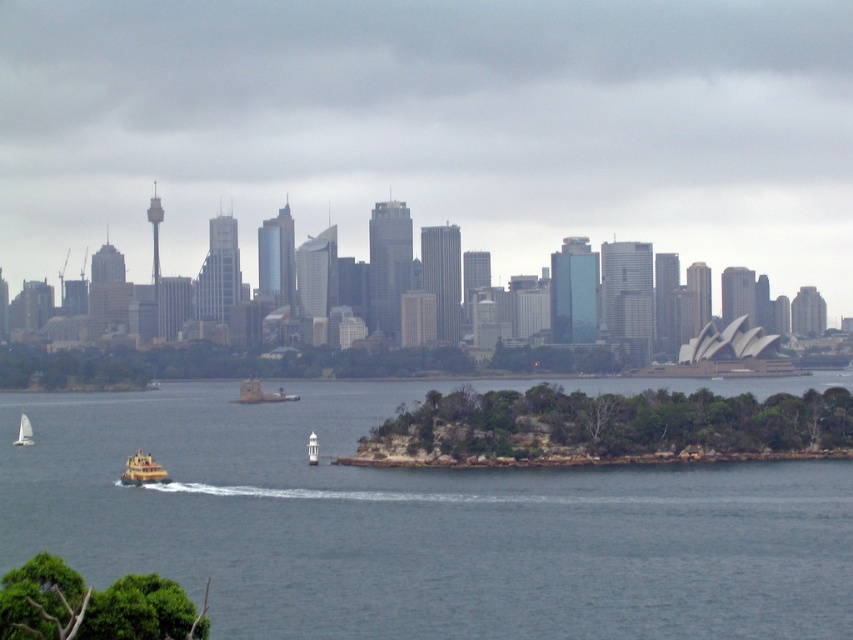
Question: Does transparent glass skyscrapers at center have a larger size compared to yellow matte boat at lower left?

Choices:
 (A) no
 (B) yes

Answer: (B)

Question: Which point is closer to the camera taking this photo?

Choices:
 (A) (x=143, y=476)
 (B) (x=22, y=508)
 (C) (x=22, y=420)

Answer: (A)

Question: From the image, what is the correct spatial relationship of transparent glass skyscrapers at center in relation to yellow matte boat at lower left?

Choices:
 (A) below
 (B) above

Answer: (B)

Question: Among these objects, which one is farthest from the camera?

Choices:
 (A) blue water at center
 (B) transparent glass skyscrapers at center
 (C) yellow matte boat at lower left
 (D) white matte sailboat at lower left

Answer: (D)

Question: Is blue water at center thinner than yellow matte boat at lower left?

Choices:
 (A) no
 (B) yes

Answer: (A)

Question: Which point is farther to the camera?

Choices:
 (A) white matte sailboat at lower left
 (B) transparent glass skyscrapers at center
 (C) blue water at center
 (D) yellow matte boat at lower left

Answer: (A)